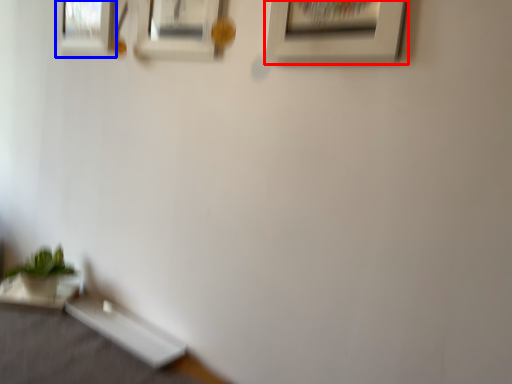
Question: Which object appears farthest to the camera in this image, picture frame (highlighted by a red box) or picture frame (highlighted by a blue box)?

Choices:
 (A) picture frame
 (B) picture frame

Answer: (B)